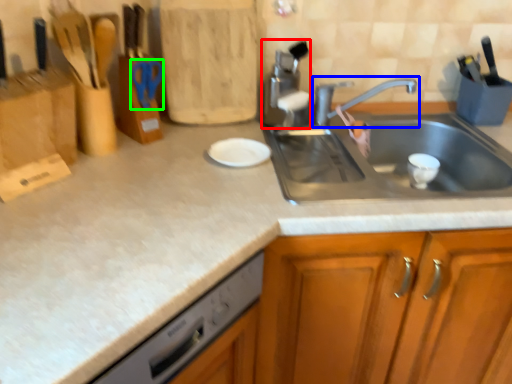
Question: Estimate the real-world distances between objects in this image. Which object is farther from appliance (highlighted by a red box), tap (highlighted by a blue box) or scissors (highlighted by a green box)?

Choices:
 (A) tap
 (B) scissors

Answer: (B)